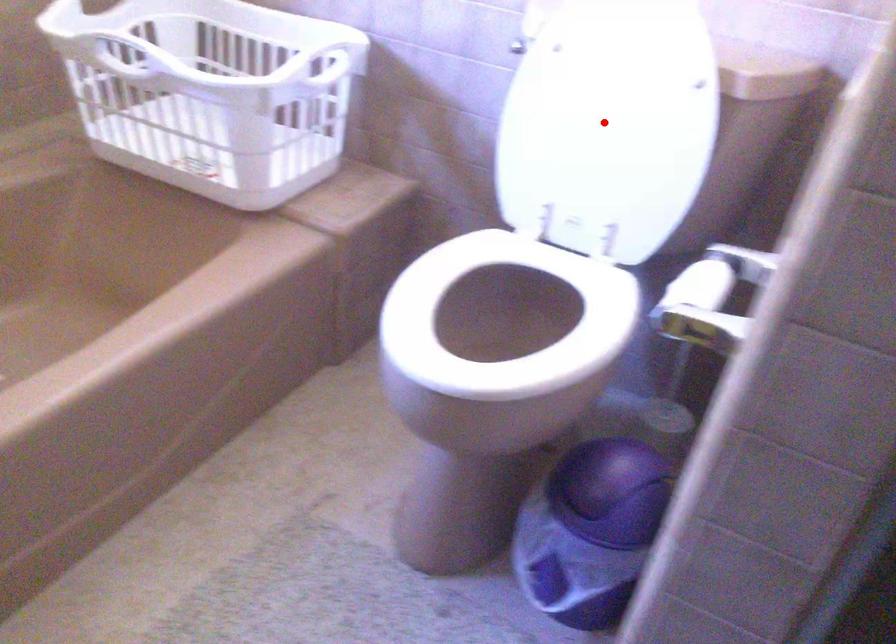
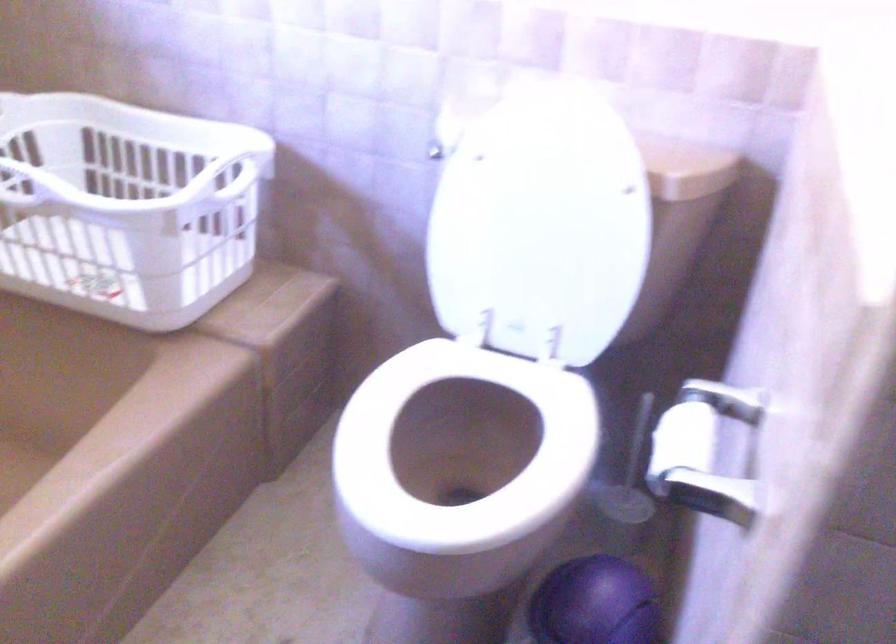
Locate, in the second image, the point that corresponds to the highlighted location in the first image.

(539, 225)